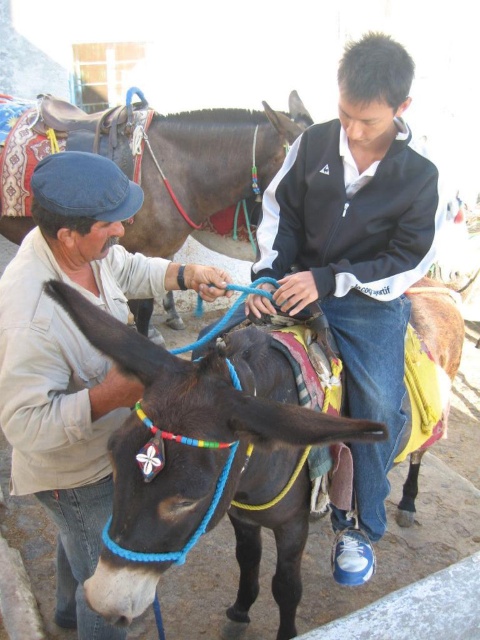
Is black glossy mule at center in front of black matte jacket at center?

Yes.

Is black glossy mule at center to the right of black matte jacket at center from the viewer's perspective?

Incorrect, black glossy mule at center is not on the right side of black matte jacket at center.

Who is more forward, (94,598) or (361,358)?

Positioned in front is point (94,598).

What are the coordinates of `black glossy mule at center` in the screenshot? It's located at (211, 458).

Can you confirm if black matte jacket at center is bigger than shiny black mule at center?

Actually, black matte jacket at center might be smaller than shiny black mule at center.

Based on the photo, who is more forward, (419, 225) or (163, 236)?

Positioned in front is point (419, 225).

The width and height of the screenshot is (480, 640). I want to click on black matte jacket at center, so click(358, 259).

Is black matte jacket at center behind light beige jacket at center?

That is True.

Can you confirm if black matte jacket at center is positioned above light beige jacket at center?

Correct, black matte jacket at center is located above light beige jacket at center.

Describe the element at coordinates (358, 259) in the screenshot. I see `black matte jacket at center` at that location.

Locate an element on the screen. The width and height of the screenshot is (480, 640). black matte jacket at center is located at coordinates (358, 259).